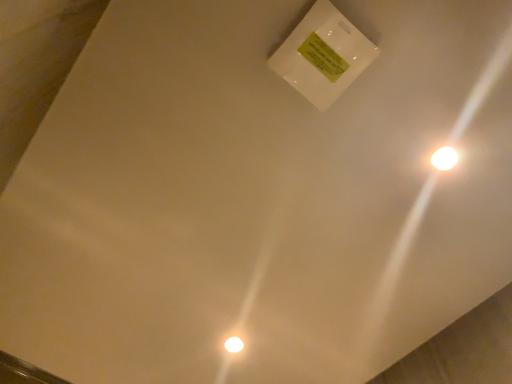
Find the location of a particular element. This screenshot has height=384, width=512. blank space to the left of white glossy light at upper right is located at coordinates (374, 154).